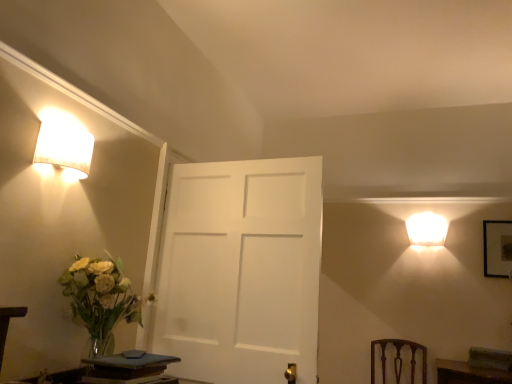
Question: Is translucent glass vase at left situated inside wooden table at lower left, which is the first table in front-to-back order, or outside?

Choices:
 (A) inside
 (B) outside

Answer: (B)

Question: In terms of width, does translucent glass vase at left look wider or thinner when compared to wooden table at lower left, the 2th table positioned from the right?

Choices:
 (A) thin
 (B) wide

Answer: (B)

Question: Which is nearer to the wooden table at lower left, positioned as the first table in left-to-right order?

Choices:
 (A) brown wood chair at lower right
 (B) matte white lampshade at upper left, positioned as the 1th lamp in front-to-back order
 (C) smooth dark wood table at lower left, the 1th table positioned from the back
 (D) white matte lampshade at upper right, the second lamp in the front-to-back sequence
 (E) translucent glass vase at left

Answer: (E)

Question: Estimate the real-world distances between objects in this image. Which object is closer to the smooth dark wood table at lower left, which is the second table in left-to-right order?

Choices:
 (A) brown wood chair at lower right
 (B) matte white lampshade at upper left, which ranks as the 2th lamp in bottom-to-top order
 (C) white matte lampshade at upper right, which appears as the 1th lamp when ordered from the bottom
 (D) translucent glass vase at left
 (E) wooden table at lower left, positioned as the first table in left-to-right order

Answer: (D)